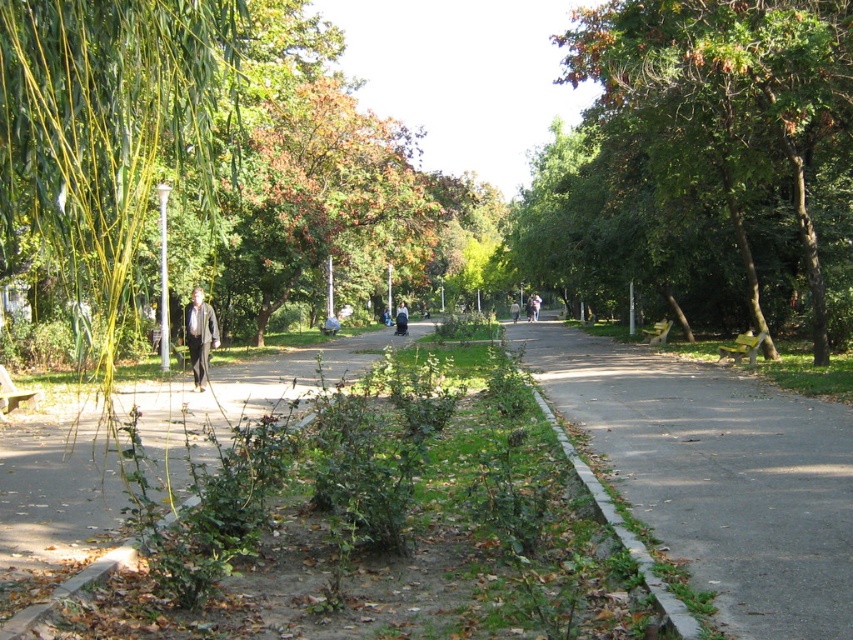
Question: Does green leafy tree at center appear under brown asphalt path at center?

Choices:
 (A) no
 (B) yes

Answer: (A)

Question: Is green leafy tree at center above light brown leather jacket at center?

Choices:
 (A) yes
 (B) no

Answer: (A)

Question: Which object appears closest to the camera in this image?

Choices:
 (A) light brown leather jacket at center
 (B) gray asphalt pavement at center
 (C) dark gray sweater at center
 (D) brown asphalt path at center

Answer: (B)

Question: Can you confirm if light brown leather jacket at center is positioned to the right of dark gray sweater at center?

Choices:
 (A) yes
 (B) no

Answer: (A)

Question: Which of the following is the closest to the observer?

Choices:
 (A) dark gray sweater at center
 (B) gray asphalt pavement at center
 (C) light brown leather jacket at center

Answer: (B)

Question: Which object is the farthest from the brown asphalt path at center?

Choices:
 (A) green leafy tree at center
 (B) gray asphalt pavement at center
 (C) light brown leather jacket at center

Answer: (A)